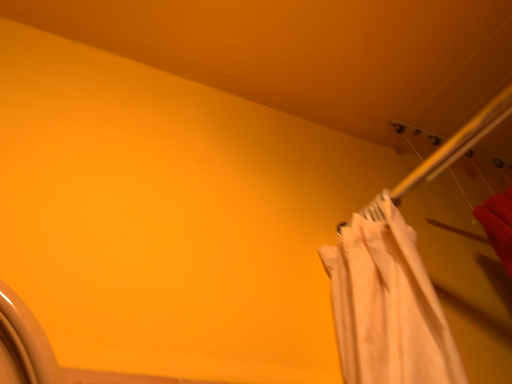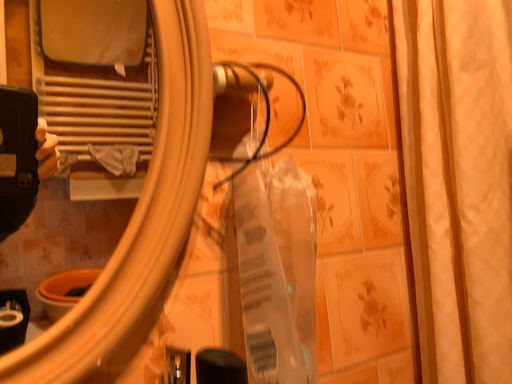
Question: Which way did the camera rotate in the video?

Choices:
 (A) rotated upward
 (B) rotated downward

Answer: (B)